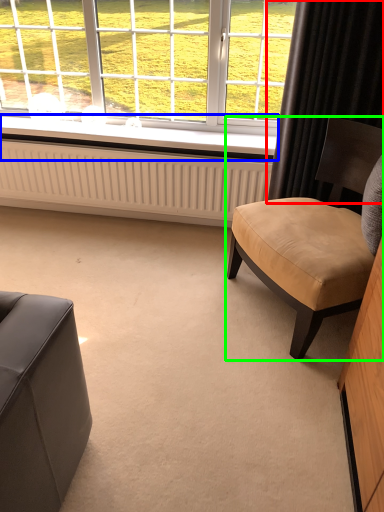
Question: Considering the real-world distances, which object is farthest from curtain (highlighted by a red box)? window sill (highlighted by a blue box) or chair (highlighted by a green box)?

Choices:
 (A) window sill
 (B) chair

Answer: (A)